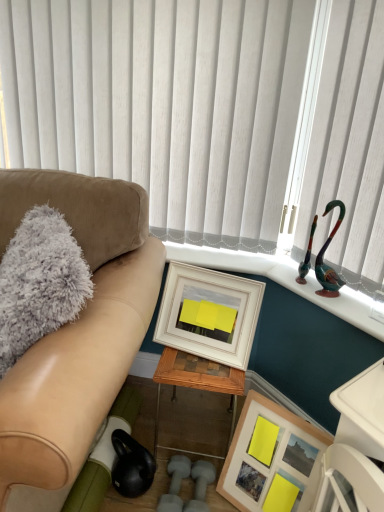
Question: Does suede couch at left have a greater width compared to shiny green glass swan at upper right?

Choices:
 (A) no
 (B) yes

Answer: (B)

Question: Is suede couch at left outside shiny green glass swan at upper right?

Choices:
 (A) no
 (B) yes

Answer: (B)

Question: Considering the relative sizes of suede couch at left and shiny green glass swan at upper right in the image provided, is suede couch at left thinner than shiny green glass swan at upper right?

Choices:
 (A) yes
 (B) no

Answer: (B)

Question: From the image's perspective, is suede couch at left under shiny green glass swan at upper right?

Choices:
 (A) no
 (B) yes

Answer: (B)

Question: Is the depth of suede couch at left less than that of shiny green glass swan at upper right?

Choices:
 (A) yes
 (B) no

Answer: (A)

Question: Does suede couch at left contain shiny green glass swan at upper right?

Choices:
 (A) no
 (B) yes

Answer: (A)

Question: Is shiny green glass swan at upper right bigger than gray fluffy pillow at left?

Choices:
 (A) yes
 (B) no

Answer: (B)

Question: Would you say gray fluffy pillow at left is part of shiny green glass swan at upper right's contents?

Choices:
 (A) no
 (B) yes

Answer: (A)

Question: Can you see shiny green glass swan at upper right touching gray fluffy pillow at left?

Choices:
 (A) no
 (B) yes

Answer: (A)

Question: Is shiny green glass swan at upper right further to the viewer compared to gray fluffy pillow at left?

Choices:
 (A) no
 (B) yes

Answer: (B)

Question: From a real-world perspective, does shiny green glass swan at upper right sit lower than gray fluffy pillow at left?

Choices:
 (A) no
 (B) yes

Answer: (A)

Question: Considering the relative positions of shiny green glass swan at upper right and gray fluffy pillow at left in the image provided, is shiny green glass swan at upper right to the left of gray fluffy pillow at left from the viewer's perspective?

Choices:
 (A) yes
 (B) no

Answer: (B)

Question: Can you confirm if woodenmaterial/texturetable at center is thinner than gray fluffy pillow at left?

Choices:
 (A) no
 (B) yes

Answer: (A)